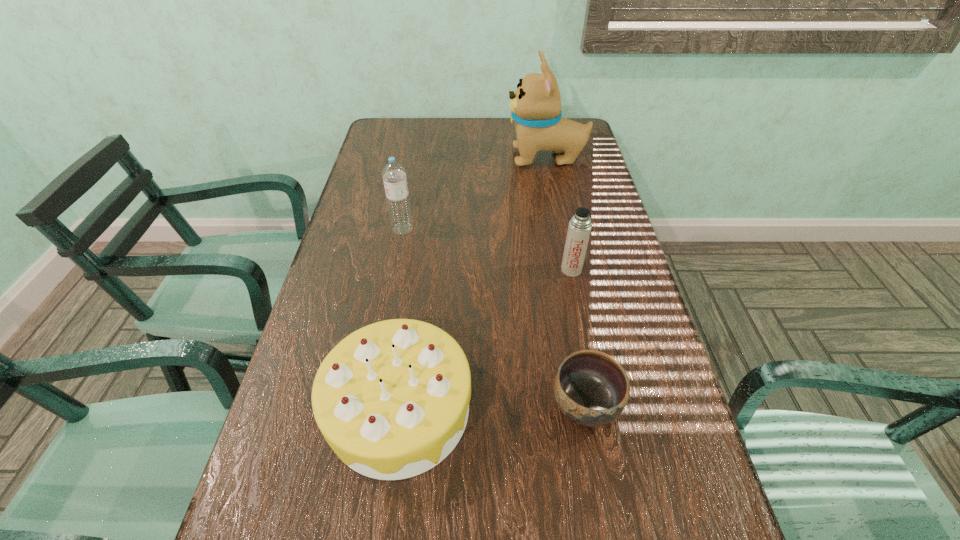
You are a GUI agent. You are given a task and a screenshot of the screen. Output one action in this format:
    pyautogui.click(x=<x>, y=<y>)
    Task: Click on the puppy
    The width and height of the screenshot is (960, 540).
    Given the screenshot: What is the action you would take?
    pyautogui.click(x=535, y=107)

Locate an element on the screen. The height and width of the screenshot is (540, 960). the tallest object is located at coordinates (535, 107).

At what (x,y) coordinates should I click in order to perform the action: click on the second tallest object. Please return your answer as a coordinate pair (x, y). Image resolution: width=960 pixels, height=540 pixels. Looking at the image, I should click on (394, 174).

Where is `the second farthest object`? This screenshot has height=540, width=960. the second farthest object is located at coordinates (394, 174).

The height and width of the screenshot is (540, 960). I want to click on the third nearest object, so click(x=579, y=228).

Where is `birthday cake`? This screenshot has width=960, height=540. birthday cake is located at coordinates (391, 399).

Find the location of a particular element. The image size is (960, 540). bowl is located at coordinates (591, 388).

Identify the location of blank area located 0.170m on the face of the tallest object. (x=457, y=158).

This screenshot has width=960, height=540. In order to click on free space located on the face of the tallest object in this screenshot , I will do `click(466, 158)`.

Where is `vacant space located 0.070m on the face of the tallest object`? vacant space located 0.070m on the face of the tallest object is located at coordinates (486, 158).